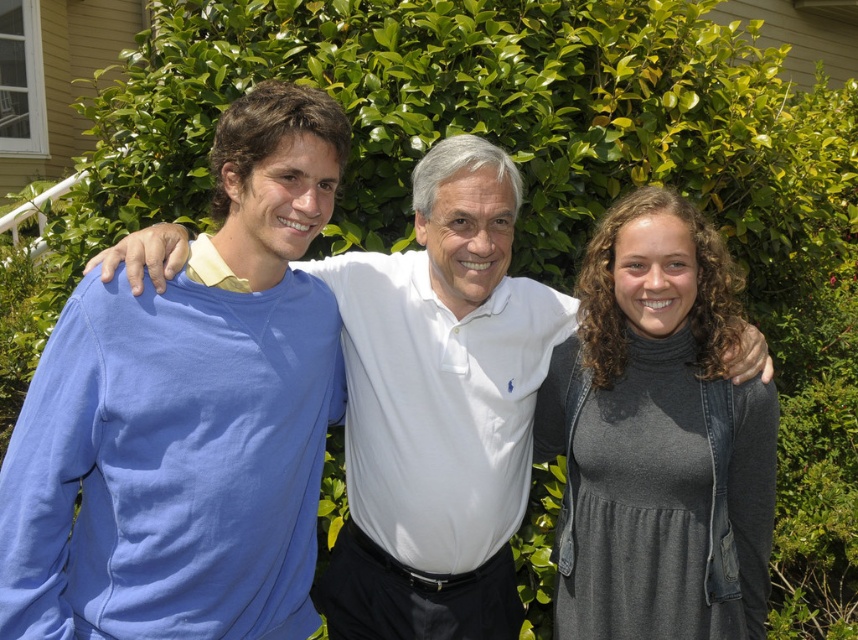
Can you confirm if blue cotton shirt at left is positioned above gray matte dress at center?

Yes.

Measure the distance between point (125, 604) and camera.

Point (125, 604) is 2.18 meters from camera.

This screenshot has width=858, height=640. In order to click on blue cotton shirt at left in this screenshot , I will do `click(188, 417)`.